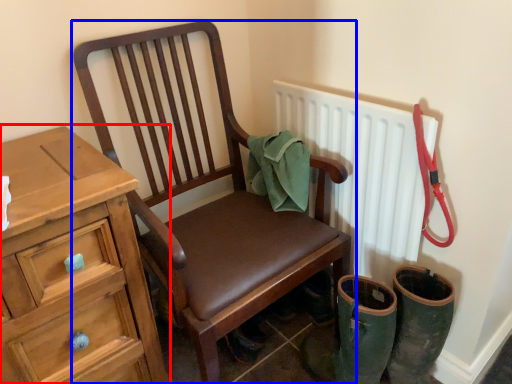
Question: Which object is closer to the camera taking this photo, chest of drawers (highlighted by a red box) or chair (highlighted by a blue box)?

Choices:
 (A) chest of drawers
 (B) chair

Answer: (A)